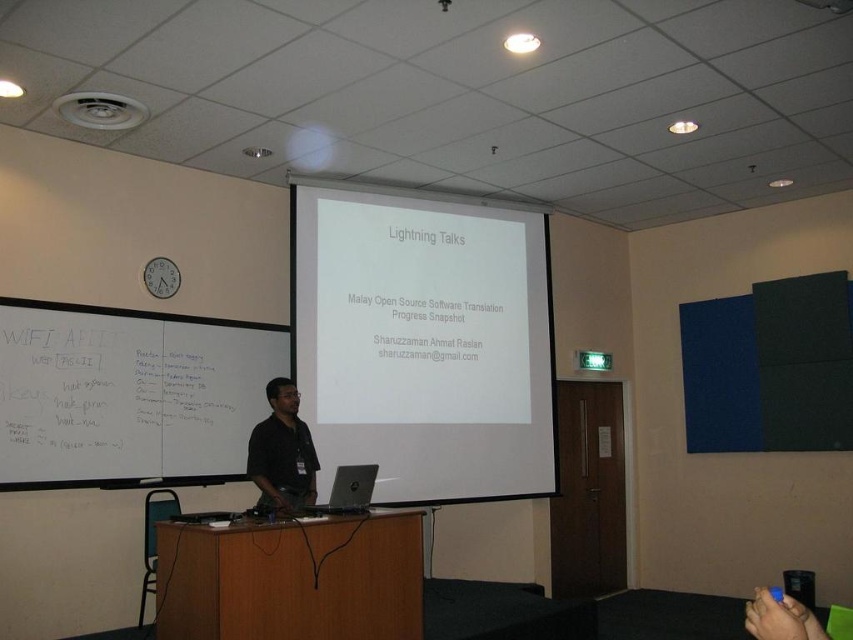
You are sitting in the classroom and need to write a note on the whiteboard at left. Can you reach it from your current position without moving your chair?

The whiteboard at left is located at point (128, 394), which means it is positioned on the left side of the room. Since you are sitting in the classroom, you can likely reach the whiteboard at left by extending your arm or moving slightly forward in your chair without needing to relocate your chair entirely.

Based on the photo, you are an attendee at the presentation and want to take a photo of the slide on the white matte projection screen at center. However, you notice the matte black shirt at center is partially blocking your view. Can you estimate whether the screen is big enough to still capture the entire slide without moving closer?

The white matte projection screen at center is larger in size than the matte black shirt at center, so it is likely that the screen extends beyond the area blocked by the shirt. Therefore, you should be able to capture the entire slide by adjusting your camera angle slightly to avoid the obstruction caused by the matte black shirt at center.

You are an attendee at the presentation and want to take notes. Which object, the whiteboard at left or the brown wood podium at center, is better suited for writing down your thoughts during the talk?

The whiteboard at left is much taller than the brown wood podium at center, making it more suitable for writing notes as it provides a larger surface area.